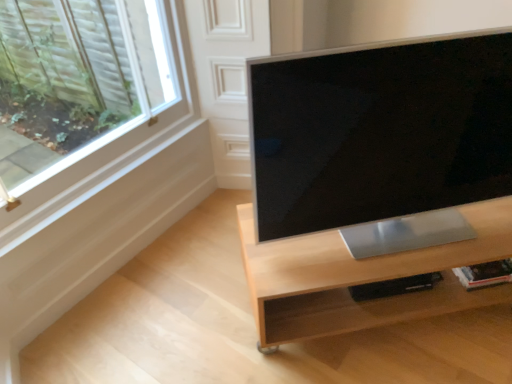
What do you see at coordinates (362, 278) in the screenshot?
I see `light wood/finish tv stand at center` at bounding box center [362, 278].

Identify the location of light wood/finish tv stand at center. This screenshot has width=512, height=384. (362, 278).

Where is `silver metallic computer monitor at center`? The height and width of the screenshot is (384, 512). silver metallic computer monitor at center is located at coordinates (380, 131).

What do you see at coordinates (380, 131) in the screenshot?
I see `silver metallic computer monitor at center` at bounding box center [380, 131].

Where is `light wood/finish tv stand at center`? The height and width of the screenshot is (384, 512). light wood/finish tv stand at center is located at coordinates (362, 278).

Based on their positions, is silver metallic computer monitor at center located to the left or right of light wood/finish tv stand at center?

silver metallic computer monitor at center is to the left of light wood/finish tv stand at center.

Which object is closer to the camera taking this photo, silver metallic computer monitor at center or light wood/finish tv stand at center?

silver metallic computer monitor at center.

Is point (360, 209) positioned in front of point (466, 214)?

Yes, it is in front of point (466, 214).

From the image's perspective, is silver metallic computer monitor at center beneath light wood/finish tv stand at center?

Incorrect, from the image's perspective, silver metallic computer monitor at center is higher than light wood/finish tv stand at center.

From a real-world perspective, which is physically above, silver metallic computer monitor at center or light wood/finish tv stand at center?

From a 3D spatial view, silver metallic computer monitor at center is above.

Considering the sizes of objects silver metallic computer monitor at center and light wood/finish tv stand at center in the image provided, who is wider, silver metallic computer monitor at center or light wood/finish tv stand at center?

light wood/finish tv stand at center.

From the picture: Considering the relative sizes of silver metallic computer monitor at center and light wood/finish tv stand at center in the image provided, is silver metallic computer monitor at center taller than light wood/finish tv stand at center?

Yes.

Who is bigger, silver metallic computer monitor at center or light wood/finish tv stand at center?

light wood/finish tv stand at center is bigger.

Is silver metallic computer monitor at center completely or partially outside of light wood/finish tv stand at center?

Absolutely, silver metallic computer monitor at center is external to light wood/finish tv stand at center.

Is silver metallic computer monitor at center far from light wood/finish tv stand at center?

No, silver metallic computer monitor at center is not far away from light wood/finish tv stand at center.

Is silver metallic computer monitor at center oriented away from light wood/finish tv stand at center?

That's not correct — silver metallic computer monitor at center is not looking away from light wood/finish tv stand at center.

What's the angular difference between silver metallic computer monitor at center and light wood/finish tv stand at center's facing directions?

The facing directions of silver metallic computer monitor at center and light wood/finish tv stand at center are 0.141 degrees apart.

Measure the distance from silver metallic computer monitor at center to light wood/finish tv stand at center.

The distance of silver metallic computer monitor at center from light wood/finish tv stand at center is 8.75 inches.

Locate an element on the screen. desk that appears on the right of silver metallic computer monitor at center is located at coordinates [x=362, y=278].

Considering the positions of objects light wood/finish tv stand at center and silver metallic computer monitor at center in the image provided, who is more to the right, light wood/finish tv stand at center or silver metallic computer monitor at center?

Positioned to the right is light wood/finish tv stand at center.

Does light wood/finish tv stand at center lie in front of silver metallic computer monitor at center?

No, light wood/finish tv stand at center is further to the viewer.

Is point (420, 257) closer or farther from the camera than point (393, 161)?

Point (420, 257) is farther from the camera than point (393, 161).

From the image's perspective, would you say light wood/finish tv stand at center is positioned over silver metallic computer monitor at center?

No, from the image's perspective, light wood/finish tv stand at center is not over silver metallic computer monitor at center.

From a real-world perspective, is light wood/finish tv stand at center above or below silver metallic computer monitor at center?

light wood/finish tv stand at center is situated lower than silver metallic computer monitor at center in the real world.

Is light wood/finish tv stand at center wider or thinner than silver metallic computer monitor at center?

In the image, light wood/finish tv stand at center appears to be wider than silver metallic computer monitor at center.

Is light wood/finish tv stand at center taller or shorter than silver metallic computer monitor at center?

Considering their sizes, light wood/finish tv stand at center has less height than silver metallic computer monitor at center.

Which of these two, light wood/finish tv stand at center or silver metallic computer monitor at center, is smaller?

Smaller between the two is silver metallic computer monitor at center.

Is silver metallic computer monitor at center located within light wood/finish tv stand at center?

No, silver metallic computer monitor at center is located outside of light wood/finish tv stand at center.

Are light wood/finish tv stand at center and silver metallic computer monitor at center located far from each other?

No, light wood/finish tv stand at center is not far away from silver metallic computer monitor at center.

Is light wood/finish tv stand at center aimed at silver metallic computer monitor at center?

No, light wood/finish tv stand at center does not turn towards silver metallic computer monitor at center.

How far apart are light wood/finish tv stand at center and silver metallic computer monitor at center?

The distance of light wood/finish tv stand at center from silver metallic computer monitor at center is 8.75 inches.

Where is `desk behind the silver metallic computer monitor at center`? This screenshot has width=512, height=384. desk behind the silver metallic computer monitor at center is located at coordinates (362, 278).

In the image, there is a silver metallic computer monitor at center. At what (x,y) coordinates should I click in order to perform the action: click on desk below it (from a real-world perspective). Please return your answer as a coordinate pair (x, y). Looking at the image, I should click on (362, 278).

Where is `desk that appears on the right of silver metallic computer monitor at center`? The width and height of the screenshot is (512, 384). desk that appears on the right of silver metallic computer monitor at center is located at coordinates click(x=362, y=278).